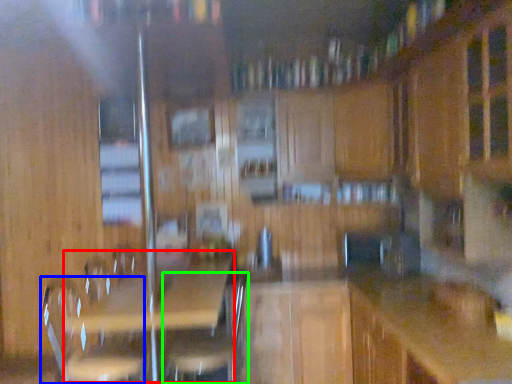
Question: Which object is positioned farthest from picnic table (highlighted by a red box)? Select from swivel chair (highlighted by a blue box) and swivel chair (highlighted by a green box).

Choices:
 (A) swivel chair
 (B) swivel chair

Answer: (A)